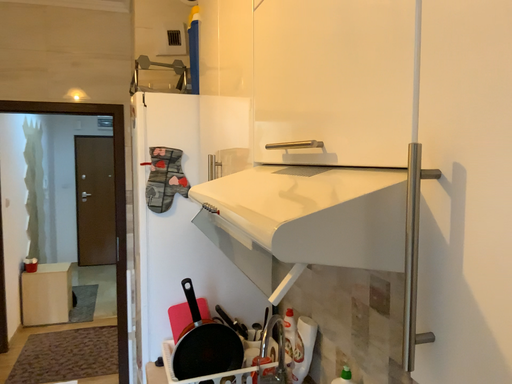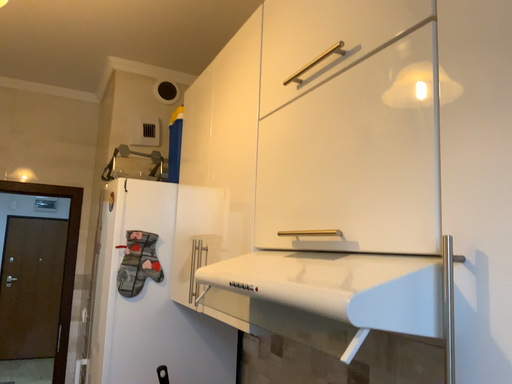
Question: How did the camera likely rotate when shooting the video?

Choices:
 (A) rotated upward
 (B) rotated downward

Answer: (A)